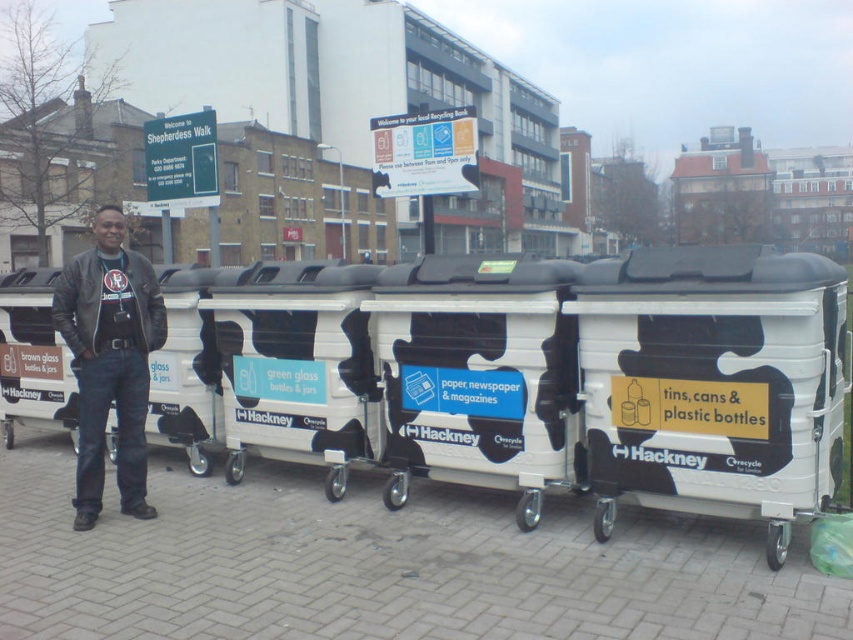
Is white matte recycling bin at right to the left of matte black jacket at center from the viewer's perspective?

In fact, white matte recycling bin at right is to the right of matte black jacket at center.

Between white matte recycling bin at right and matte black jacket at center, which one appears on the right side from the viewer's perspective?

Positioned to the right is white matte recycling bin at right.

Which is behind, point (639, 444) or point (107, 305)?

The point (107, 305) is more distant.

I want to click on white matte recycling bin at right, so click(714, 381).

Looking at this image, is white glossy recycling bin at center above white paper sign at center?

Actually, white glossy recycling bin at center is below white paper sign at center.

Which is behind, point (415, 385) or point (396, 131)?

The point (396, 131) is behind.

This screenshot has height=640, width=853. Identify the location of white glossy recycling bin at center. (479, 376).

The image size is (853, 640). What do you see at coordinates (109, 360) in the screenshot?
I see `matte black jacket at center` at bounding box center [109, 360].

Does matte black jacket at center come in front of green plastic sign at upper center?

Yes, matte black jacket at center is in front of green plastic sign at upper center.

What do you see at coordinates (109, 360) in the screenshot?
I see `matte black jacket at center` at bounding box center [109, 360].

Identify the location of matte black jacket at center. (109, 360).